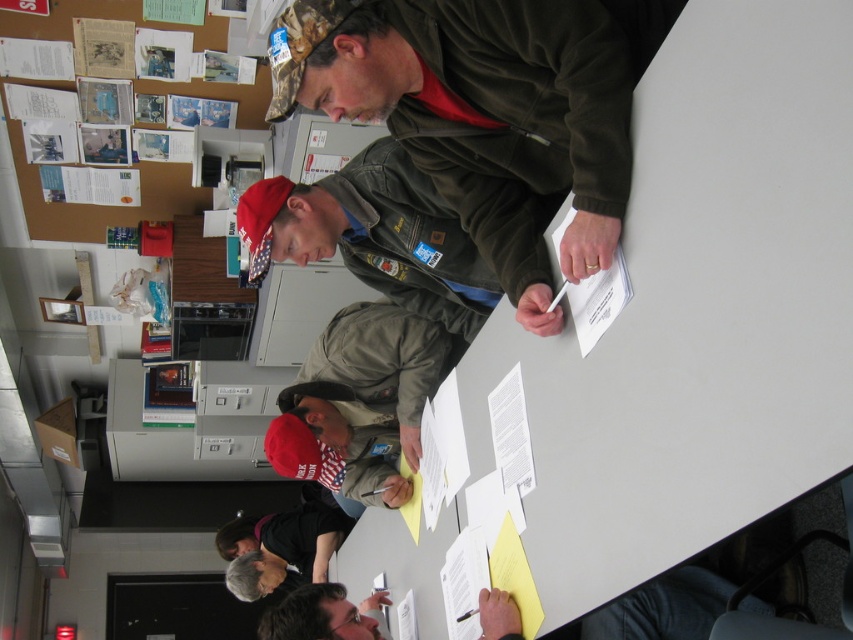
Which is more to the left, brown paperboard at upper left or dark gray shirt at lower center?

From the viewer's perspective, brown paperboard at upper left appears more on the left side.

Can you confirm if brown paperboard at upper left is thinner than dark gray shirt at lower center?

Incorrect, brown paperboard at upper left's width is not less than dark gray shirt at lower center's.

Which is in front, point (10, 22) or point (292, 568)?

Positioned in front is point (10, 22).

Identify the location of brown paperboard at upper left. (96, 205).

Consider the image. Between white matte table at center and dark gray shirt at lower center, which one is positioned lower?

A: Positioned lower is dark gray shirt at lower center.

Who is higher up, white matte table at center or dark gray shirt at lower center?

white matte table at center is above.

Is point (436, 596) behind point (343, 515)?

That is False.

Where is `white matte table at center`? The height and width of the screenshot is (640, 853). white matte table at center is located at coordinates (692, 316).

Is dark gray fabric shirt at lower center smaller than dark gray shirt at lower center?

Indeed, dark gray fabric shirt at lower center has a smaller size compared to dark gray shirt at lower center.

Who is shorter, dark gray fabric shirt at lower center or dark gray shirt at lower center?

Standing shorter between the two is dark gray fabric shirt at lower center.

Which is in front, point (289, 620) or point (245, 584)?

Point (289, 620) is more forward.

Find the location of a particular element. dark gray fabric shirt at lower center is located at coordinates (663, 609).